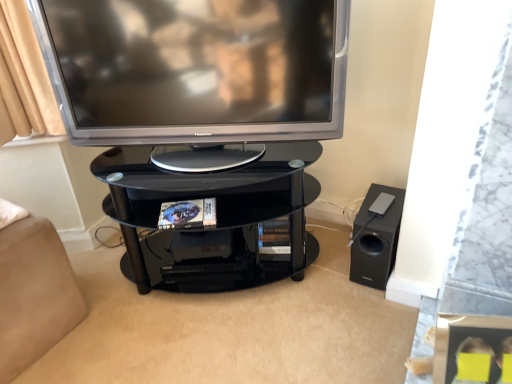
At what (x,y) coordinates should I click in order to perform the action: click on vacant point to the right of beige fabric bed at lower left. Please return your answer as a coordinate pair (x, y). Image resolution: width=512 pixels, height=384 pixels. Looking at the image, I should click on (108, 329).